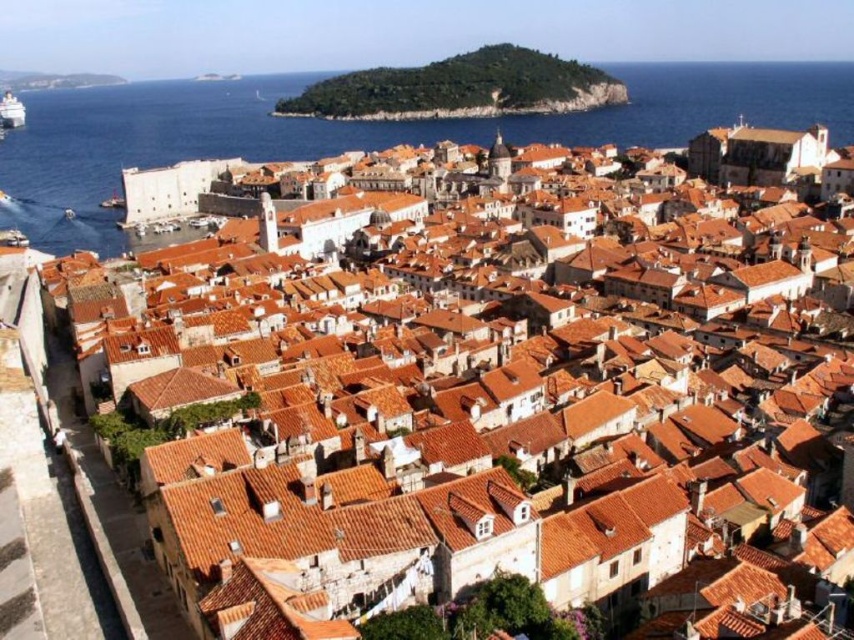
Is blue water at lower left thinner than green leafy hillside at upper center?

No.

Can you confirm if blue water at lower left is positioned below green leafy hillside at upper center?

Indeed, blue water at lower left is positioned under green leafy hillside at upper center.

What do you see at coordinates (355, 131) in the screenshot? I see `blue water at lower left` at bounding box center [355, 131].

This screenshot has height=640, width=854. I want to click on blue water at lower left, so click(355, 131).

Does green leafy hillside at upper center have a greater width compared to white plastic boat at upper left?

Correct, the width of green leafy hillside at upper center exceeds that of white plastic boat at upper left.

Is green leafy hillside at upper center positioned behind white plastic boat at upper left?

No, it is in front of white plastic boat at upper left.

Is point (371, 104) farther from viewer compared to point (1, 112)?

That is False.

Find the location of `green leafy hillside at upper center`. green leafy hillside at upper center is located at coordinates (460, 88).

Between blue water at lower left and white plastic boat at upper left, which one is positioned lower?

blue water at lower left is lower down.

Does blue water at lower left appear over white plastic boat at upper left?

Actually, blue water at lower left is below white plastic boat at upper left.

Identify the location of blue water at lower left. (355, 131).